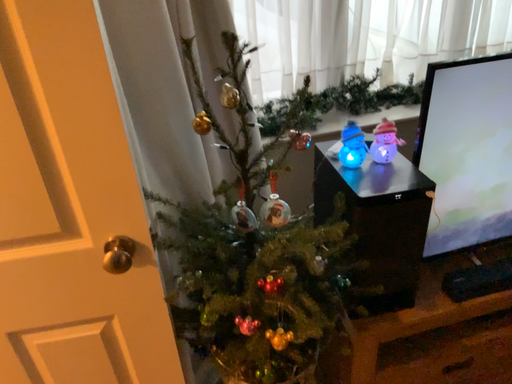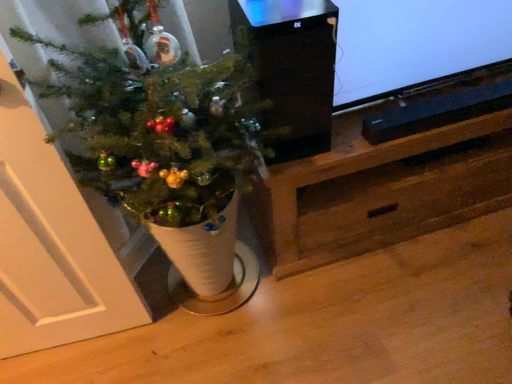
Question: Which way did the camera rotate in the video?

Choices:
 (A) rotated downward
 (B) rotated upward

Answer: (A)